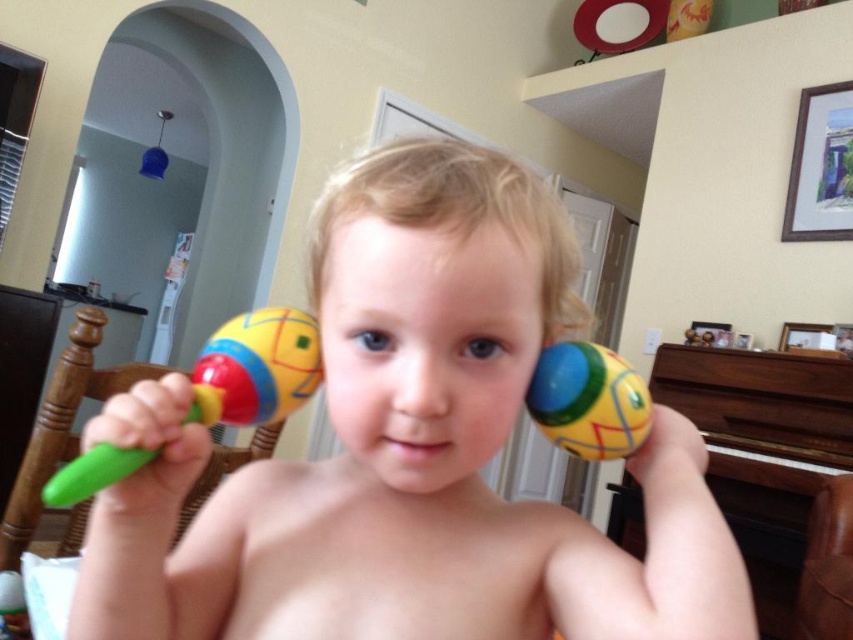
You are a photographer setting up for a family portrait in this room. You have two points marked on the floor where you need to place two lights. The first light must be placed at point [561,576], and the second at point [300,310]. Since the room is small, you want to know which light will be closer to the camera position. Based on the scene description, which point is closer to the camera?

Point [561,576] is in front of point [300,310], so the light placed at point [561,576] will be closer to the camera.